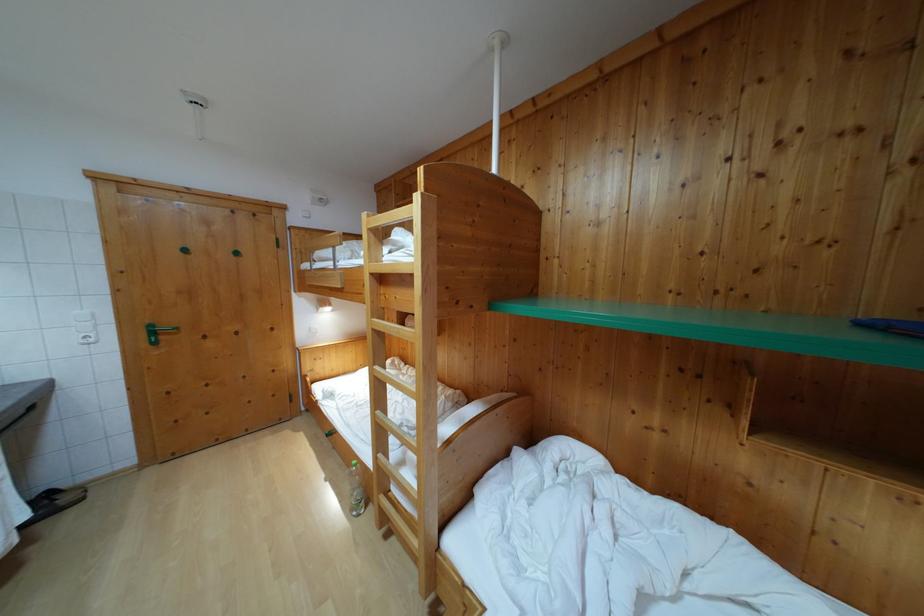
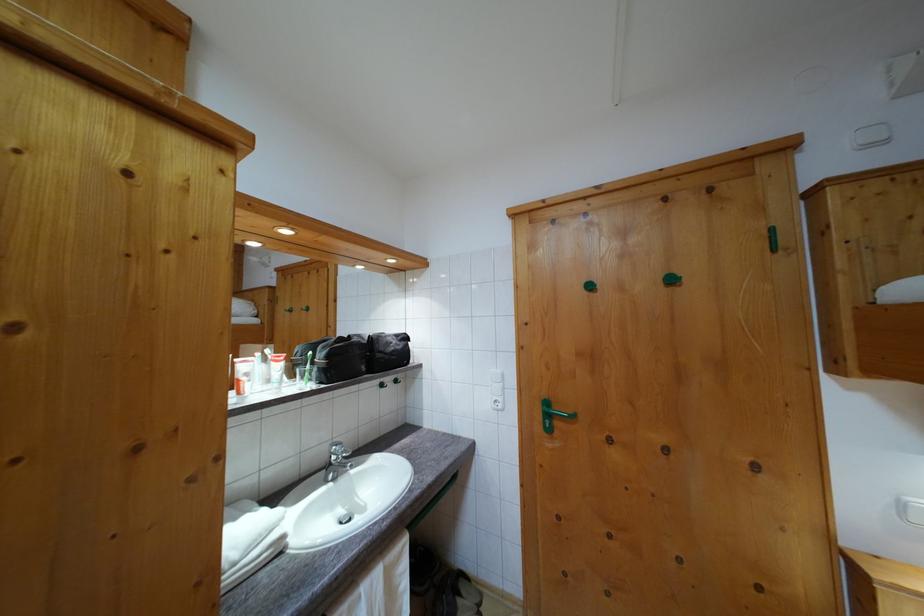
Find the pixel in the second image that matches pixel 155 333 in the first image.

(551, 410)